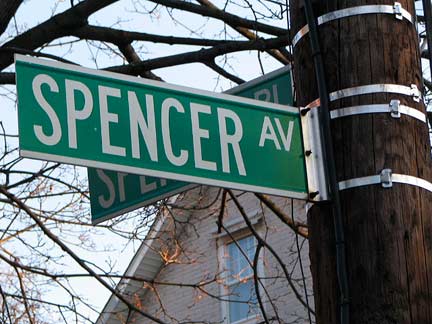
Where is `upper window sash`? The image size is (432, 324). upper window sash is located at coordinates (238, 230).